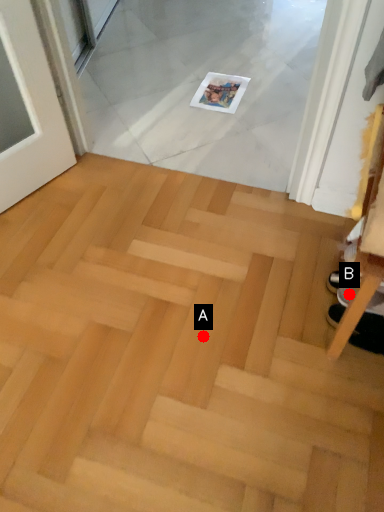
Question: Two points are circled on the image, labeled by A and B beside each circle. Which of the following is the closest to the observer?

Choices:
 (A) A is closer
 (B) B is closer

Answer: (B)